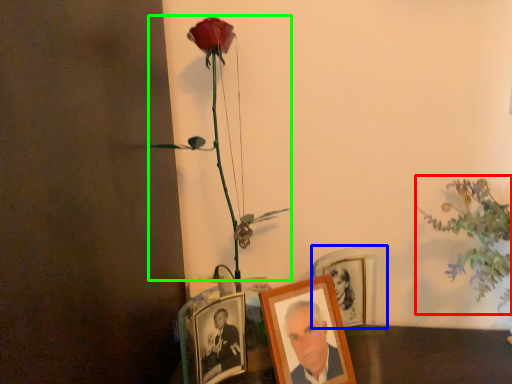
Question: Based on their relative distances, which object is nearer to floral arrangement (highlighted by a red box)? Choose from picture frame (highlighted by a blue box) and floral arrangement (highlighted by a green box).

Choices:
 (A) picture frame
 (B) floral arrangement

Answer: (A)